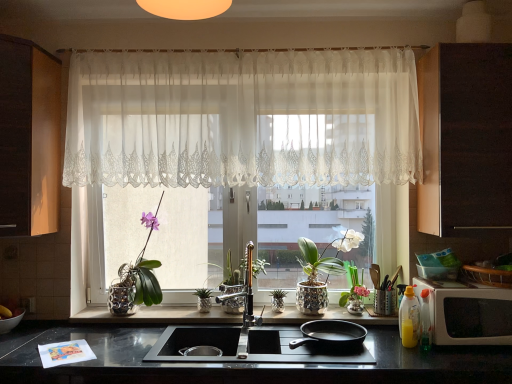
How much space does green metallic pineapple at center, marked as the second plant in a left-to-right arrangement, occupy horizontally?

4.10 inches.

Where is `matte silver pot at center, marked as the 2th floral arrangement in a right-to-left arrangement`? This screenshot has height=384, width=512. matte silver pot at center, marked as the 2th floral arrangement in a right-to-left arrangement is located at coordinates (138, 276).

The width and height of the screenshot is (512, 384). Describe the element at coordinates (138, 276) in the screenshot. I see `matte silver pot at center, marked as the 2th floral arrangement in a right-to-left arrangement` at that location.

The image size is (512, 384). Describe the element at coordinates (237, 363) in the screenshot. I see `black granite countertop at lower center` at that location.

The height and width of the screenshot is (384, 512). Identify the location of black granite countertop at lower center. (237, 363).

Locate an element on the screen. black matte gas stove at center is located at coordinates (251, 347).

Relative to black granite countertop at lower center, is matte silver pot at center, marked as the 2th floral arrangement in a right-to-left arrangement, in front or behind?

Clearly, matte silver pot at center, marked as the 2th floral arrangement in a right-to-left arrangement, is behind black granite countertop at lower center.

From the image's perspective, is matte silver pot at center, the 1th floral arrangement viewed from the left, located above or below black granite countertop at lower center?

From the image's perspective, matte silver pot at center, the 1th floral arrangement viewed from the left, appears above black granite countertop at lower center.

Which object is wider, matte silver pot at center, marked as the 2th floral arrangement in a right-to-left arrangement, or black granite countertop at lower center?

black granite countertop at lower center is wider.

You are a GUI agent. You are given a task and a screenshot of the screen. Output one action in this format:
    pyautogui.click(x=<x>, y=<y>)
    Task: Click on the countertop that is on the right side of matte silver pot at center, marked as the 2th floral arrangement in a right-to-left arrangement
    This screenshot has width=512, height=384.
    Given the screenshot: What is the action you would take?
    237,363

Considering the relative sizes of metallic silver pot at center, positioned as the second plant in right-to-left order, and matte wood cabinet at left, the second cabinetry in the right-to-left sequence, in the image provided, is metallic silver pot at center, positioned as the second plant in right-to-left order, taller than matte wood cabinet at left, the second cabinetry in the right-to-left sequence,?

Incorrect, the height of metallic silver pot at center, positioned as the second plant in right-to-left order, is not larger of that of matte wood cabinet at left, the second cabinetry in the right-to-left sequence.

How many degrees apart are the facing directions of metallic silver pot at center, positioned as the second plant in right-to-left order, and matte wood cabinet at left, the second cabinetry in the right-to-left sequence?

There is a 91.6-degree angle between the facing directions of metallic silver pot at center, positioned as the second plant in right-to-left order, and matte wood cabinet at left, the second cabinetry in the right-to-left sequence.

Is metallic silver pot at center, positioned as the second plant in right-to-left order, aimed at matte wood cabinet at left, positioned as the 1th cabinetry in left-to-right order?

No, metallic silver pot at center, positioned as the second plant in right-to-left order, does not turn towards matte wood cabinet at left, positioned as the 1th cabinetry in left-to-right order.

Is metallic silver pot at center, positioned as the second plant in right-to-left order, placed right next to matte wood cabinet at left, positioned as the 1th cabinetry in left-to-right order?

They are not placed beside each other.

Consider the image. Which is in front, pink glass vase at center, which is the first floral arrangement in right-to-left order, or green metallic pineapple at center, marked as the second plant in a left-to-right arrangement?

pink glass vase at center, which is the first floral arrangement in right-to-left order, is more forward.

In the scene shown: Is pink glass vase at center, which is the first floral arrangement in right-to-left order, oriented away from green metallic pineapple at center, the 1th plant from the right?

No.

Is pink glass vase at center, arranged as the 2th floral arrangement when viewed from the left, located outside green metallic pineapple at center, marked as the second plant in a left-to-right arrangement?

pink glass vase at center, arranged as the 2th floral arrangement when viewed from the left, lies outside green metallic pineapple at center, marked as the second plant in a left-to-right arrangement,'s area.

Which object is positioned more to the left, pink glass vase at center, which is the first floral arrangement in right-to-left order, or green metallic pineapple at center, marked as the second plant in a left-to-right arrangement?

green metallic pineapple at center, marked as the second plant in a left-to-right arrangement.

In the scene shown: What's the angular difference between matte wood cabinet at left, the second cabinetry in the right-to-left sequence, and translucent plastic bottle at lower right's facing directions?

matte wood cabinet at left, the second cabinetry in the right-to-left sequence, and translucent plastic bottle at lower right are facing 107 degrees away from each other.

Considering the positions of point (23, 199) and point (424, 311), is point (23, 199) closer or farther from the camera than point (424, 311)?

Clearly, point (23, 199) is closer to the camera than point (424, 311).

Is the position of matte wood cabinet at left, positioned as the 1th cabinetry in left-to-right order, less distant than that of translucent plastic bottle at lower right?

Yes, the depth of matte wood cabinet at left, positioned as the 1th cabinetry in left-to-right order, is less than that of translucent plastic bottle at lower right.

Considering the sizes of objects matte wood cabinet at left, the second cabinetry in the right-to-left sequence, and translucent plastic bottle at lower right in the image provided, who is taller, matte wood cabinet at left, the second cabinetry in the right-to-left sequence, or translucent plastic bottle at lower right?

matte wood cabinet at left, the second cabinetry in the right-to-left sequence.

Which object is thinner, dark wood cabinet at right, the 1th cabinetry from the right, or white glossy microwave at right?

With smaller width is white glossy microwave at right.

Is dark wood cabinet at right, marked as the 2th cabinetry in a left-to-right arrangement, placed right next to white glossy microwave at right?

No, dark wood cabinet at right, marked as the 2th cabinetry in a left-to-right arrangement, is not with white glossy microwave at right.

Does dark wood cabinet at right, the 1th cabinetry from the right, have a larger size compared to white glossy microwave at right?

Yes, dark wood cabinet at right, the 1th cabinetry from the right, is bigger than white glossy microwave at right.

Is dark wood cabinet at right, marked as the 2th cabinetry in a left-to-right arrangement, facing towards white glossy microwave at right?

No, dark wood cabinet at right, marked as the 2th cabinetry in a left-to-right arrangement, is not oriented towards white glossy microwave at right.

Can you confirm if dark wood cabinet at right, marked as the 2th cabinetry in a left-to-right arrangement, is positioned to the right of black matte frying pan at center?

Indeed, dark wood cabinet at right, marked as the 2th cabinetry in a left-to-right arrangement, is positioned on the right side of black matte frying pan at center.

Is dark wood cabinet at right, marked as the 2th cabinetry in a left-to-right arrangement, positioned beyond the bounds of black matte frying pan at center?

Yes.

Image resolution: width=512 pixels, height=384 pixels. Find the location of `frying pan below the dark wood cabinet at right, the 1th cabinetry from the right (from the image's perspective)`. frying pan below the dark wood cabinet at right, the 1th cabinetry from the right (from the image's perspective) is located at coordinates (331, 334).

From a real-world perspective, does dark wood cabinet at right, marked as the 2th cabinetry in a left-to-right arrangement, stand above black matte frying pan at center?

Yes, from a real-world perspective, dark wood cabinet at right, marked as the 2th cabinetry in a left-to-right arrangement, is on top of black matte frying pan at center.

You are a GUI agent. You are given a task and a screenshot of the screen. Output one action in this format:
    pyautogui.click(x=<x>, y=<y>)
    Task: Click on the bottle in front of the pink glass vase at center, arranged as the 2th floral arrangement when viewed from the left
    This screenshot has height=384, width=512.
    Given the screenshot: What is the action you would take?
    pyautogui.click(x=425, y=321)

Is point (356, 270) positioned in front of point (424, 325)?

That is False.

Which of these two, pink glass vase at center, arranged as the 2th floral arrangement when viewed from the left, or translucent plastic bottle at lower right, is thinner?

With smaller width is translucent plastic bottle at lower right.

Where is `countertop located on the right of matte silver pot at center, the 1th floral arrangement viewed from the left`? countertop located on the right of matte silver pot at center, the 1th floral arrangement viewed from the left is located at coordinates (237, 363).

You are a GUI agent. You are given a task and a screenshot of the screen. Output one action in this format:
    pyautogui.click(x=<x>, y=<y>)
    Task: Click on the 1st plant positioned below the matte wood cabinet at left, the second cabinetry in the right-to-left sequence (from the image's perspective)
    Image resolution: width=512 pixels, height=384 pixels.
    Given the screenshot: What is the action you would take?
    pyautogui.click(x=218, y=268)

Which object lies further to the anchor point matte wood cabinet at left, positioned as the 1th cabinetry in left-to-right order, sheer white lace curtain at center or dark wood cabinet at right, marked as the 2th cabinetry in a left-to-right arrangement?

dark wood cabinet at right, marked as the 2th cabinetry in a left-to-right arrangement.

When comparing their distances from black matte frying pan at center, does black matte gas stove at center or sheer white lace curtain at center seem closer?

Among the two, black matte gas stove at center is located nearer to black matte frying pan at center.

Considering their positions, is matte silver pot at center, the 1th floral arrangement viewed from the left, positioned further to white glossy pot at center than matte wood cabinet at left, positioned as the 1th cabinetry in left-to-right order?

Among the two, matte wood cabinet at left, positioned as the 1th cabinetry in left-to-right order, is located further to white glossy pot at center.

From the image, which object appears to be farther from pink glass vase at center, arranged as the 2th floral arrangement when viewed from the left, white glossy microwave at right or translucent plastic bottle at lower right?

The object further to pink glass vase at center, arranged as the 2th floral arrangement when viewed from the left, is white glossy microwave at right.

Estimate the real-world distances between objects in this image. Which object is closer to matte silver pot at center, marked as the 2th floral arrangement in a right-to-left arrangement, green metallic pineapple at center, the 1th plant from the right, or translucent plastic bottle at lower right?

green metallic pineapple at center, the 1th plant from the right.

Considering their positions, is black matte frying pan at center positioned closer to matte wood cabinet at left, the second cabinetry in the right-to-left sequence, than metallic silver pot at center, positioned as the second plant in right-to-left order?

metallic silver pot at center, positioned as the second plant in right-to-left order.

In the scene shown: Based on their spatial positions, is black matte frying pan at center or sheer white lace curtain at center closer to green metallic pineapple at center, marked as the second plant in a left-to-right arrangement?

Based on the image, black matte frying pan at center appears to be nearer to green metallic pineapple at center, marked as the second plant in a left-to-right arrangement.

Looking at the image, which one is located closer to translucent plastic bottle at lower right, metallic silver pot at center, which is the first plant from left to right, or green metallic pineapple at center, the 1th plant from the right?

green metallic pineapple at center, the 1th plant from the right, is closer to translucent plastic bottle at lower right.

Identify the location of gas stove between polished brass faucet at center and black granite countertop at lower center vertically. (251, 347).

The image size is (512, 384). I want to click on tap between sheer white lace curtain at center and black matte frying pan at center in the vertical direction, so click(245, 291).

Image resolution: width=512 pixels, height=384 pixels. Find the location of `bottle between black matte frying pan at center and pink glass vase at center, arranged as the 2th floral arrangement when viewed from the left, in the front-back direction`. bottle between black matte frying pan at center and pink glass vase at center, arranged as the 2th floral arrangement when viewed from the left, in the front-back direction is located at coordinates (425, 321).

I want to click on gas stove situated between sheer white lace curtain at center and dark wood cabinet at right, the 1th cabinetry from the right, from left to right, so click(x=251, y=347).